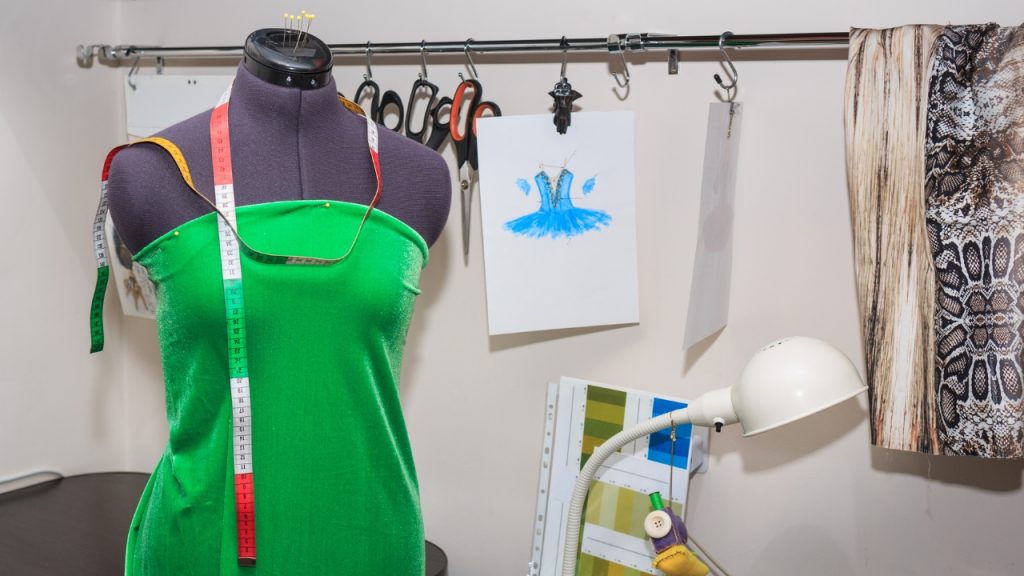
Find the location of a particular element. The width and height of the screenshot is (1024, 576). color swatches is located at coordinates (600, 410), (656, 446), (616, 507), (606, 566).